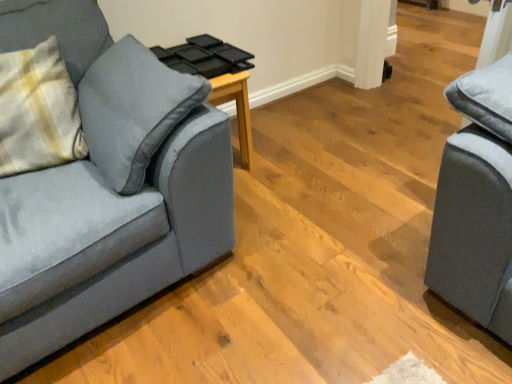
Image resolution: width=512 pixels, height=384 pixels. Describe the element at coordinates (38, 111) in the screenshot. I see `plaid fabric pillow at left` at that location.

Where is `velvet gray couch at left`? velvet gray couch at left is located at coordinates (108, 238).

Between wooden side table at center and plaid fabric pillow at left, which one is positioned behind?

wooden side table at center is behind.

The width and height of the screenshot is (512, 384). I want to click on side table that appears below the plaid fabric pillow at left (from a real-world perspective), so click(x=217, y=77).

Based on the photo, considering the sizes of objects wooden side table at center and plaid fabric pillow at left in the image provided, who is thinner, wooden side table at center or plaid fabric pillow at left?

With smaller width is plaid fabric pillow at left.

Can you see wooden side table at center touching plaid fabric pillow at left?

wooden side table at center is not next to plaid fabric pillow at left, and they're not touching.

Is plaid fabric pillow at left bigger or smaller than wooden side table at center?

In the image, plaid fabric pillow at left appears to be larger than wooden side table at center.

Which is further, (3, 132) or (170, 64)?

The point (170, 64) is farther.

Is plaid fabric pillow at left facing away from wooden side table at center?

plaid fabric pillow at left is not turned away from wooden side table at center.

Is wooden side table at center surrounded by plaid fabric pillow at left?

That's incorrect, wooden side table at center is not inside plaid fabric pillow at left.

From the picture: From the image's perspective, which one is positioned higher, plaid fabric pillow at left or velvet gray couch at left?

plaid fabric pillow at left is shown above in the image.

Does plaid fabric pillow at left have a greater width compared to velvet gray couch at left?

In fact, plaid fabric pillow at left might be narrower than velvet gray couch at left.

Does plaid fabric pillow at left turn towards velvet gray couch at left?

Yes, plaid fabric pillow at left faces towards velvet gray couch at left.

Between plaid fabric pillow at left and velvet gray couch at left, which one is positioned in front?

velvet gray couch at left is in front.

Considering the sizes of objects velvet gray couch at left and wooden side table at center in the image provided, who is wider, velvet gray couch at left or wooden side table at center?

velvet gray couch at left.

Relative to wooden side table at center, is velvet gray couch at left in front or behind?

Clearly, velvet gray couch at left is in front of wooden side table at center.

From a real-world perspective, which is physically below, velvet gray couch at left or wooden side table at center?

wooden side table at center.

The image size is (512, 384). I want to click on throw pillow lying on the left of velvet gray couch at left, so click(38, 111).

Which of these two, velvet gray couch at left or plaid fabric pillow at left, is wider?

velvet gray couch at left is wider.

Can you confirm if velvet gray couch at left is shorter than plaid fabric pillow at left?

No, velvet gray couch at left is not shorter than plaid fabric pillow at left.

Relative to plaid fabric pillow at left, is velvet gray couch at left in front or behind?

velvet gray couch at left is in front of plaid fabric pillow at left.

In terms of height, does wooden side table at center look taller or shorter compared to velvet gray couch at left?

In the image, wooden side table at center appears to be shorter than velvet gray couch at left.

What's the angular difference between wooden side table at center and velvet gray couch at left's facing directions?

3.25 degrees separate the facing orientations of wooden side table at center and velvet gray couch at left.

From a real-world perspective, is wooden side table at center on velvet gray couch at left?

Actually, wooden side table at center is physically below velvet gray couch at left in the real world.

From the image's perspective, is wooden side table at center located above velvet gray couch at left?

Yes, from the image's perspective, wooden side table at center is over velvet gray couch at left.

Identify the location of side table located underneath the plaid fabric pillow at left (from a real-world perspective). (217, 77).

The width and height of the screenshot is (512, 384). What are the coordinates of `throw pillow located in front of the wooden side table at center` in the screenshot? It's located at tap(38, 111).

When comparing their distances from plaid fabric pillow at left, does wooden side table at center or velvet gray couch at left seem further?

wooden side table at center is further to plaid fabric pillow at left.

Which object lies further to the anchor point wooden side table at center, plaid fabric pillow at left or velvet gray couch at left?

velvet gray couch at left.

Looking at the image, which one is located further to velvet gray couch at left, plaid fabric pillow at left or wooden side table at center?

Among the two, wooden side table at center is located further to velvet gray couch at left.

Which object lies nearer to the anchor point plaid fabric pillow at left, velvet gray couch at left or wooden side table at center?

velvet gray couch at left is closer to plaid fabric pillow at left.

Based on their spatial positions, is wooden side table at center or plaid fabric pillow at left further from velvet gray couch at left?

Based on the image, wooden side table at center appears to be further to velvet gray couch at left.

Looking at the image, which one is located closer to wooden side table at center, velvet gray couch at left or plaid fabric pillow at left?

plaid fabric pillow at left is positioned closer to the anchor wooden side table at center.

Find the location of `throw pillow between velvet gray couch at left and wooden side table at center from front to back`. throw pillow between velvet gray couch at left and wooden side table at center from front to back is located at coordinates (38, 111).